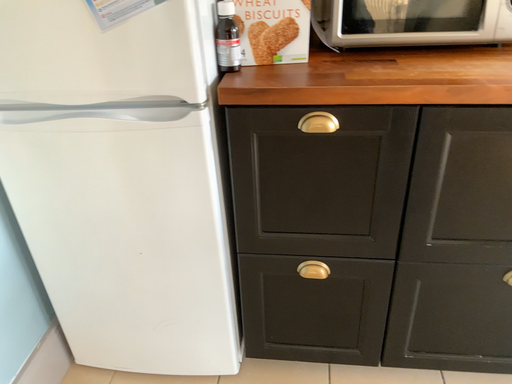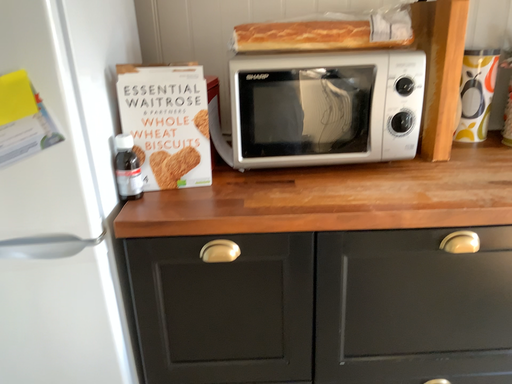
Question: How did the camera likely rotate when shooting the video?

Choices:
 (A) rotated left
 (B) rotated right

Answer: (B)